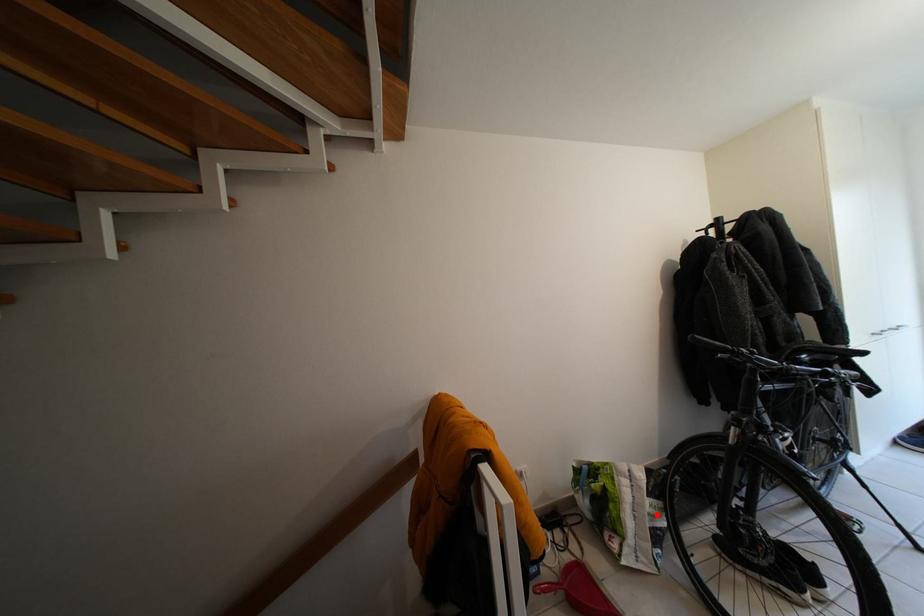
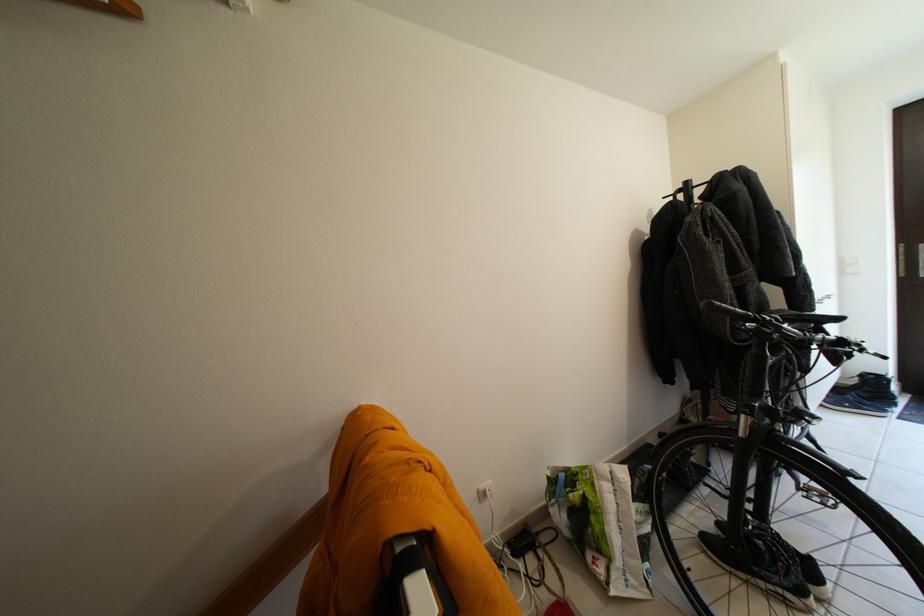
Where in the second image is the point corresponding to the highlighted location from the first image?

(642, 522)